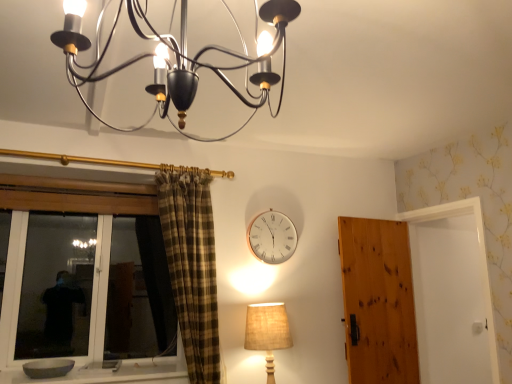
What do you see at coordinates (214, 66) in the screenshot?
I see `metallic chandelier at upper center, positioned as the second lamp in back-to-front order` at bounding box center [214, 66].

Identify the location of white metallic clock at upper center. The height and width of the screenshot is (384, 512). (272, 237).

From the image's perspective, would you say white metallic clock at upper center is positioned over burlap beige lampshade at lower right, acting as the 1th lamp starting from the back?

Yes, from the image's perspective, white metallic clock at upper center is on top of burlap beige lampshade at lower right, acting as the 1th lamp starting from the back.

Is the depth of white metallic clock at upper center less than that of burlap beige lampshade at lower right, acting as the 1th lamp starting from the back?

No, it is not.

Locate an element on the screen. wall clock above the burlap beige lampshade at lower right, the 2th lamp when ordered from top to bottom (from a real-world perspective) is located at coordinates (272, 237).

Is white metallic clock at upper center positioned far away from burlap beige lampshade at lower right, the first lamp from the bottom?

No, white metallic clock at upper center is not far away from burlap beige lampshade at lower right, the first lamp from the bottom.

Which is closer, (265, 254) or (57, 382)?

Point (265, 254) is positioned farther from the camera compared to point (57, 382).

Based on their sizes in the image, would you say white metallic clock at upper center is bigger or smaller than gray stone bowl at lower left?

Considering their sizes, white metallic clock at upper center takes up less space than gray stone bowl at lower left.

What are the coordinates of `window sill on the left of white metallic clock at upper center` in the screenshot? It's located at (113, 373).

Does point (258, 314) come farther from viewer compared to point (180, 89)?

Yes, it is behind point (180, 89).

Is there a large distance between burlap beige lampshade at lower right, acting as the 1th lamp starting from the back, and metallic chandelier at upper center, the 2th lamp in the bottom-to-top sequence?

Yes, burlap beige lampshade at lower right, acting as the 1th lamp starting from the back, and metallic chandelier at upper center, the 2th lamp in the bottom-to-top sequence, are quite far apart.

Which object is further away from the camera taking this photo, burlap beige lampshade at lower right, acting as the 1th lamp starting from the back, or metallic chandelier at upper center, the 2th lamp in the bottom-to-top sequence?

burlap beige lampshade at lower right, acting as the 1th lamp starting from the back, is further from the camera.

Looking at this image, which of these two, burlap beige lampshade at lower right, the first lamp from the bottom, or metallic chandelier at upper center, the 1th lamp from the top, is bigger?

Bigger between the two is metallic chandelier at upper center, the 1th lamp from the top.

Does gray stone bowl at lower left have a greater height compared to burlap beige lampshade at lower right, acting as the 1th lamp starting from the back?

No, gray stone bowl at lower left is not taller than burlap beige lampshade at lower right, acting as the 1th lamp starting from the back.

Considering the sizes of objects gray stone bowl at lower left and burlap beige lampshade at lower right, the first lamp from the bottom, in the image provided, who is wider, gray stone bowl at lower left or burlap beige lampshade at lower right, the first lamp from the bottom,?

With larger width is gray stone bowl at lower left.

Is gray stone bowl at lower left smaller than burlap beige lampshade at lower right, the 2th lamp when ordered from top to bottom?

Yes.

Where is `window sill lying below the burlap beige lampshade at lower right, acting as the 1th lamp starting from the back (from the image's perspective)`? window sill lying below the burlap beige lampshade at lower right, acting as the 1th lamp starting from the back (from the image's perspective) is located at coordinates (113, 373).

Considering the relative sizes of wooden door at right and white metallic clock at upper center in the image provided, is wooden door at right wider than white metallic clock at upper center?

Yes.

Based on the photo, is wooden door at right looking in the opposite direction of white metallic clock at upper center?

wooden door at right does not have its back to white metallic clock at upper center.

Considering the sizes of objects wooden door at right and white metallic clock at upper center in the image provided, who is shorter, wooden door at right or white metallic clock at upper center?

Standing shorter between the two is white metallic clock at upper center.

Based on the photo, can you confirm if wooden door at right is bigger than white metallic clock at upper center?

Correct, wooden door at right is larger in size than white metallic clock at upper center.

Is the position of gray stone bowl at lower left more distant than that of metallic chandelier at upper center, positioned as the second lamp in back-to-front order?

That is True.

Which object is thinner, gray stone bowl at lower left or metallic chandelier at upper center, which is counted as the 1th lamp, starting from the front?

With smaller width is metallic chandelier at upper center, which is counted as the 1th lamp, starting from the front.

Would you say gray stone bowl at lower left is inside or outside metallic chandelier at upper center, positioned as the second lamp in back-to-front order?

gray stone bowl at lower left is not enclosed by metallic chandelier at upper center, positioned as the second lamp in back-to-front order.

In order to click on the 1st lamp to the right of the gray stone bowl at lower left, counting from the anchor's position in this screenshot , I will do `click(214, 66)`.

Based on the photo, is white metallic clock at upper center touching metallic chandelier at upper center, the 2th lamp in the bottom-to-top sequence?

There is a gap between white metallic clock at upper center and metallic chandelier at upper center, the 2th lamp in the bottom-to-top sequence.

From the image's perspective, between white metallic clock at upper center and metallic chandelier at upper center, which is counted as the 1th lamp, starting from the front, who is located below?

white metallic clock at upper center is shown below in the image.

Choose the correct answer: Is white metallic clock at upper center inside metallic chandelier at upper center, the 2th lamp in the bottom-to-top sequence, or outside it?

white metallic clock at upper center is outside metallic chandelier at upper center, the 2th lamp in the bottom-to-top sequence.

Does white metallic clock at upper center turn towards metallic chandelier at upper center, positioned as the second lamp in back-to-front order?

No, white metallic clock at upper center is not facing towards metallic chandelier at upper center, positioned as the second lamp in back-to-front order.

Where is `wall clock above the burlap beige lampshade at lower right, the first lamp from the bottom (from a real-world perspective)`? Image resolution: width=512 pixels, height=384 pixels. wall clock above the burlap beige lampshade at lower right, the first lamp from the bottom (from a real-world perspective) is located at coordinates (272, 237).

What are the coordinates of `window sill below the white metallic clock at upper center (from the image's perspective)` in the screenshot? It's located at (113, 373).

When comparing their distances from white metallic clock at upper center, does metallic chandelier at upper center, positioned as the second lamp in back-to-front order, or burlap beige lampshade at lower right, the first lamp from the bottom, seem further?

metallic chandelier at upper center, positioned as the second lamp in back-to-front order, is positioned further to the anchor white metallic clock at upper center.

Looking at the image, which one is located closer to gray stone bowl at lower left, metallic chandelier at upper center, the 1th lamp from the top, or burlap beige lampshade at lower right, which ranks as the 2th lamp in front-to-back order?

burlap beige lampshade at lower right, which ranks as the 2th lamp in front-to-back order.

Based on their spatial positions, is white metallic clock at upper center or wooden door at right closer to gray stone bowl at lower left?

white metallic clock at upper center is closer to gray stone bowl at lower left.

Which object lies nearer to the anchor point gray stone bowl at lower left, wooden door at right or metallic chandelier at upper center, which is counted as the 1th lamp, starting from the front?

Among the two, wooden door at right is located nearer to gray stone bowl at lower left.

Consider the image. When comparing their distances from metallic chandelier at upper center, which is counted as the 1th lamp, starting from the front, does white metallic clock at upper center or burlap beige lampshade at lower right, which ranks as the 2th lamp in front-to-back order, seem further?

burlap beige lampshade at lower right, which ranks as the 2th lamp in front-to-back order, is positioned further to the anchor metallic chandelier at upper center, which is counted as the 1th lamp, starting from the front.

When comparing their distances from burlap beige lampshade at lower right, the first lamp from the bottom, does gray stone bowl at lower left or metallic chandelier at upper center, the 2th lamp in the bottom-to-top sequence, seem further?

Based on the image, metallic chandelier at upper center, the 2th lamp in the bottom-to-top sequence, appears to be further to burlap beige lampshade at lower right, the first lamp from the bottom.

From the image, which object appears to be nearer to white metallic clock at upper center, burlap beige lampshade at lower right, acting as the 1th lamp starting from the back, or wooden door at right?

burlap beige lampshade at lower right, acting as the 1th lamp starting from the back, is positioned closer to the anchor white metallic clock at upper center.

Estimate the real-world distances between objects in this image. Which object is further from burlap beige lampshade at lower right, the first lamp from the bottom, metallic chandelier at upper center, the 1th lamp from the top, or gray stone bowl at lower left?

Among the two, metallic chandelier at upper center, the 1th lamp from the top, is located further to burlap beige lampshade at lower right, the first lamp from the bottom.

Image resolution: width=512 pixels, height=384 pixels. Find the location of `lamp located between metallic chandelier at upper center, the 1th lamp from the top, and wooden door at right in the depth direction`. lamp located between metallic chandelier at upper center, the 1th lamp from the top, and wooden door at right in the depth direction is located at coordinates (267, 332).

What are the coordinates of `door located between metallic chandelier at upper center, the 2th lamp in the bottom-to-top sequence, and white metallic clock at upper center in the depth direction` in the screenshot? It's located at (378, 301).

I want to click on window sill between metallic chandelier at upper center, the 2th lamp in the bottom-to-top sequence, and burlap beige lampshade at lower right, which ranks as the 2th lamp in front-to-back order, in the front-back direction, so pos(113,373).

Image resolution: width=512 pixels, height=384 pixels. I want to click on wall clock located between burlap beige lampshade at lower right, which ranks as the 2th lamp in front-to-back order, and wooden door at right in the left-right direction, so click(272, 237).